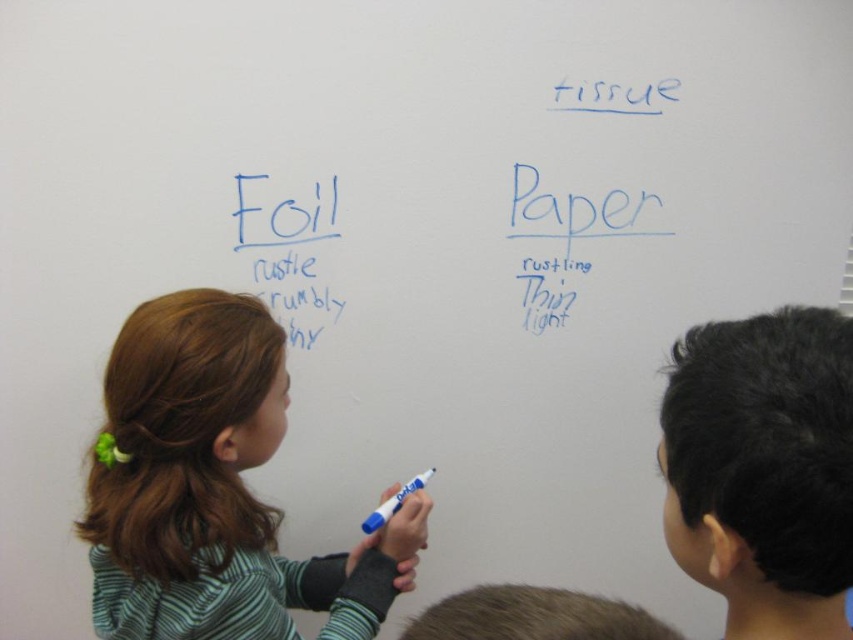
In the scene shown: Measure the distance between point (660, 426) and camera.

→ They are 29.31 inches apart.

Who is lower down, black hair at upper right or blue marker at center?

blue marker at center is below.

Which is behind, point (683, 460) or point (419, 477)?

Point (419, 477)

The height and width of the screenshot is (640, 853). Find the location of `black hair at upper right`. black hair at upper right is located at coordinates (763, 468).

Does green striped shirt at center left have a larger size compared to blue marker at center?

Indeed, green striped shirt at center left has a larger size compared to blue marker at center.

Which is behind, point (209, 368) or point (395, 504)?

The point (395, 504) is more distant.

Between point (352, 621) and point (381, 509), which one is positioned in front?

Point (352, 621)

I want to click on green striped shirt at center left, so click(x=213, y=488).

Measure the distance between green striped shirt at center left and camera.

The distance of green striped shirt at center left from camera is 38.00 inches.

Who is taller, green striped shirt at center left or black hair at upper right?

With more height is green striped shirt at center left.

What do you see at coordinates (213, 488) in the screenshot?
I see `green striped shirt at center left` at bounding box center [213, 488].

Locate an element on the screen. green striped shirt at center left is located at coordinates (213, 488).